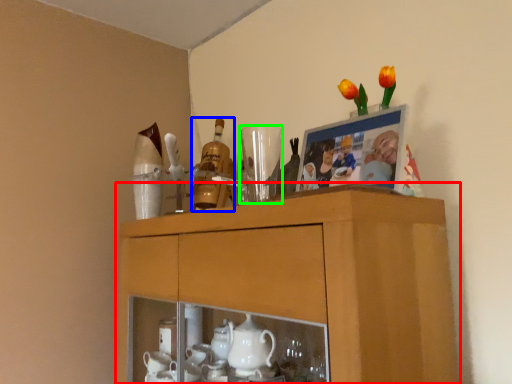
Question: Which object is positioned farthest from cabinetry (highlighted by a red box)? Select from bottle (highlighted by a blue box) and tableware (highlighted by a green box).

Choices:
 (A) bottle
 (B) tableware

Answer: (A)